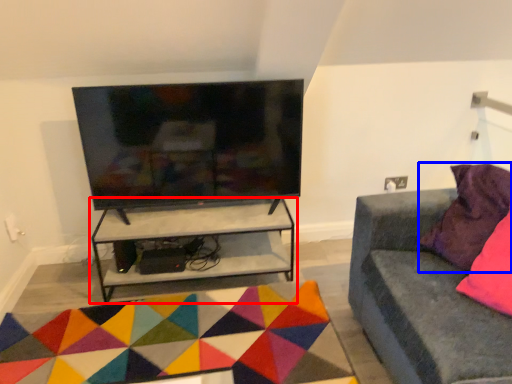
Question: Among these objects, which one is nearest to the camera, shelf (highlighted by a red box) or pillow (highlighted by a blue box)?

Choices:
 (A) shelf
 (B) pillow

Answer: (B)